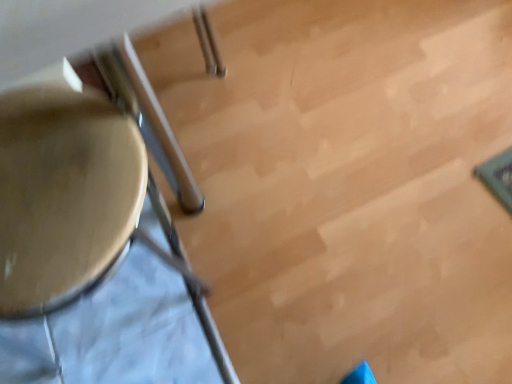
The height and width of the screenshot is (384, 512). Find the location of `wooden chair at left`. wooden chair at left is located at coordinates (92, 209).

The width and height of the screenshot is (512, 384). Describe the element at coordinates (92, 209) in the screenshot. I see `wooden chair at left` at that location.

You are a GUI agent. You are given a task and a screenshot of the screen. Output one action in this format:
    pyautogui.click(x=<x>, y=<y>)
    Task: Click on the wooden chair at left
    This screenshot has height=384, width=512.
    Given the screenshot: What is the action you would take?
    coord(92,209)